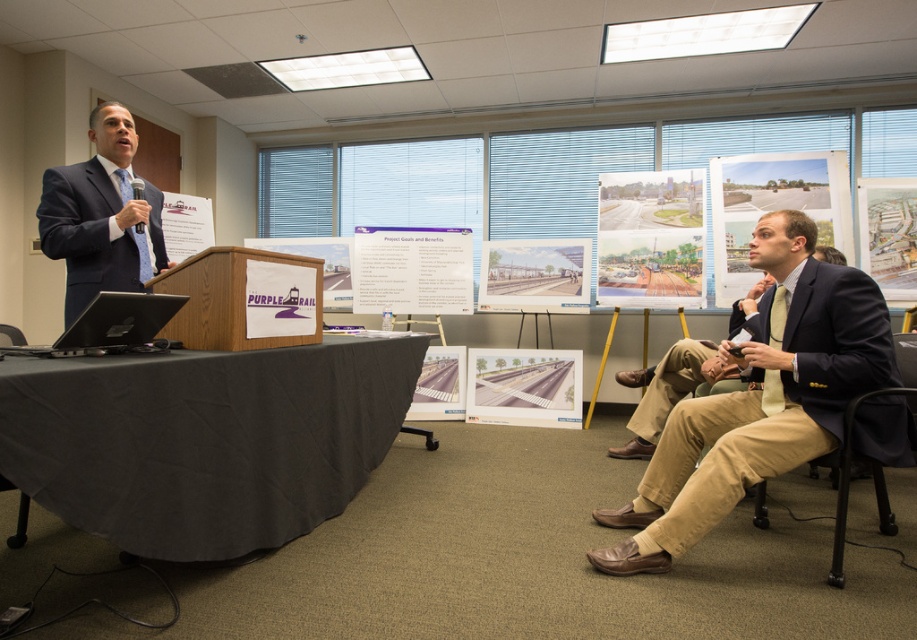
Image resolution: width=917 pixels, height=640 pixels. What are the coordinates of `matte navy suit at right` in the screenshot? It's located at (760, 397).

Find the location of a particular element. matte navy suit at right is located at coordinates (760, 397).

Consider the image. Is black fabric table at lower left below matte paper map at upper right?

Yes.

Who is lower down, black fabric table at lower left or matte paper map at upper right?

black fabric table at lower left is below.

What do you see at coordinates (204, 440) in the screenshot?
I see `black fabric table at lower left` at bounding box center [204, 440].

Locate an element on the screen. black fabric table at lower left is located at coordinates (204, 440).

Who is more distant from viewer, [326,300] or [172,257]?

Positioned behind is point [326,300].

The height and width of the screenshot is (640, 917). Describe the element at coordinates (322, 266) in the screenshot. I see `purple cardboard sign at center` at that location.

Does point (242, 244) come farther from viewer compared to point (206, 220)?

Yes.

Where is `purple cardboard sign at center`? This screenshot has width=917, height=640. purple cardboard sign at center is located at coordinates (322, 266).